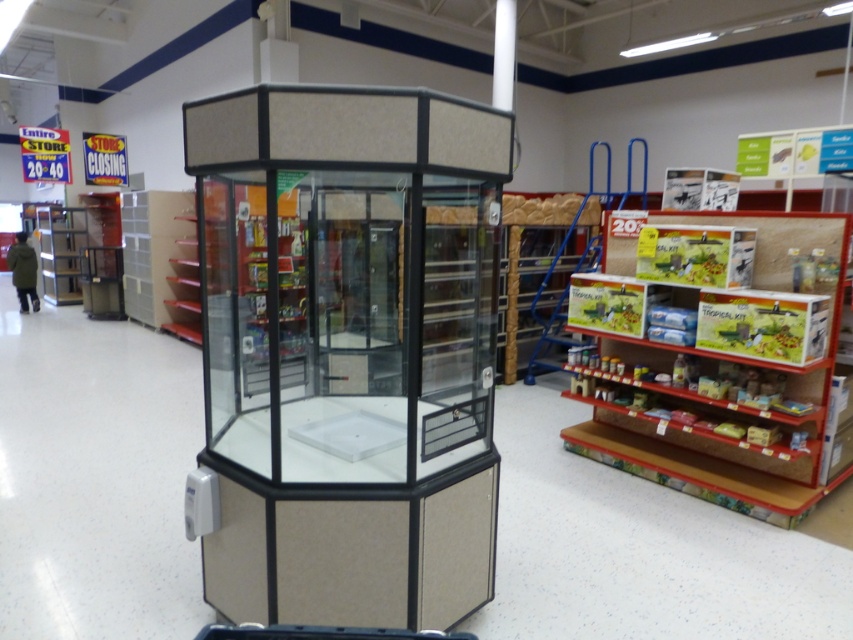
You are standing in the store and want to move from point (688, 304) to point (15, 253). Which direction should you move to get closer to your destination?

You should move downward and to the left because point (15, 253) is located below and to the left of point (688, 304).

You are a customer in the store and you want to place the green matte jacket at left onto the wooden textured shelf at right. Can you fit it on the shelf?

The wooden textured shelf at right is bigger than the green matte jacket at left, so yes, the jacket can be placed on the shelf.